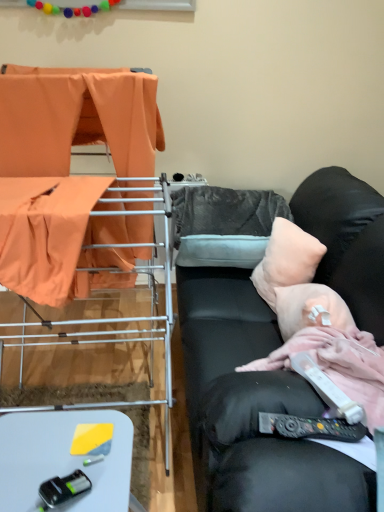
Question: Would you consider peachy soft pillow at right, acting as the second pillow starting from the back, to be distant from white plastic table at lower left?

Choices:
 (A) yes
 (B) no

Answer: (B)

Question: Would you say white plastic table at lower left is part of peachy soft pillow at right, acting as the second pillow starting from the back,'s contents?

Choices:
 (A) yes
 (B) no

Answer: (B)

Question: Does peachy soft pillow at right, the 1th pillow from the front, turn towards white plastic table at lower left?

Choices:
 (A) yes
 (B) no

Answer: (A)

Question: Considering the relative positions of peachy soft pillow at right, the 1th pillow from the front, and white plastic table at lower left in the image provided, is peachy soft pillow at right, the 1th pillow from the front, to the left of white plastic table at lower left from the viewer's perspective?

Choices:
 (A) yes
 (B) no

Answer: (B)

Question: From the image's perspective, is peachy soft pillow at right, the 1th pillow from the front, beneath white plastic table at lower left?

Choices:
 (A) yes
 (B) no

Answer: (B)

Question: From the image's perspective, is gray fuzzy pillow at center, the second pillow in the front-to-back sequence, above or below black leather couch at right?

Choices:
 (A) above
 (B) below

Answer: (A)

Question: Visually, is gray fuzzy pillow at center, the second pillow in the front-to-back sequence, positioned to the left or to the right of black leather couch at right?

Choices:
 (A) right
 (B) left

Answer: (B)

Question: Considering the positions of point (187, 211) and point (350, 238), is point (187, 211) closer or farther from the camera than point (350, 238)?

Choices:
 (A) farther
 (B) closer

Answer: (A)

Question: Choose the correct answer: Is gray fuzzy pillow at center, the second pillow in the front-to-back sequence, inside black leather couch at right or outside it?

Choices:
 (A) outside
 (B) inside

Answer: (B)

Question: From their relative heights in the image, would you say pink fabric at right is taller or shorter than orange fabric at left, marked as the second furniture in a front-to-back arrangement?

Choices:
 (A) tall
 (B) short

Answer: (B)

Question: From a real-world perspective, relative to orange fabric at left, the first furniture when ordered from back to front, is pink fabric at right vertically above or below?

Choices:
 (A) above
 (B) below

Answer: (B)

Question: Is pink fabric at right spatially inside orange fabric at left, marked as the second furniture in a front-to-back arrangement, or outside of it?

Choices:
 (A) inside
 (B) outside

Answer: (B)

Question: In terms of width, does pink fabric at right look wider or thinner when compared to orange fabric at left, marked as the second furniture in a front-to-back arrangement?

Choices:
 (A) thin
 (B) wide

Answer: (A)

Question: Considering the positions of orange fabric at left, marked as the second furniture in a front-to-back arrangement, and white plastic remote control at lower right, which appears as the 1th equipment when viewed from the top, in the image, is orange fabric at left, marked as the second furniture in a front-to-back arrangement, wider or thinner than white plastic remote control at lower right, which appears as the 1th equipment when viewed from the top,?

Choices:
 (A) wide
 (B) thin

Answer: (A)

Question: Based on their positions, is orange fabric at left, marked as the second furniture in a front-to-back arrangement, located to the left or right of white plastic remote control at lower right, which appears as the 1th equipment when viewed from the top?

Choices:
 (A) right
 (B) left

Answer: (B)